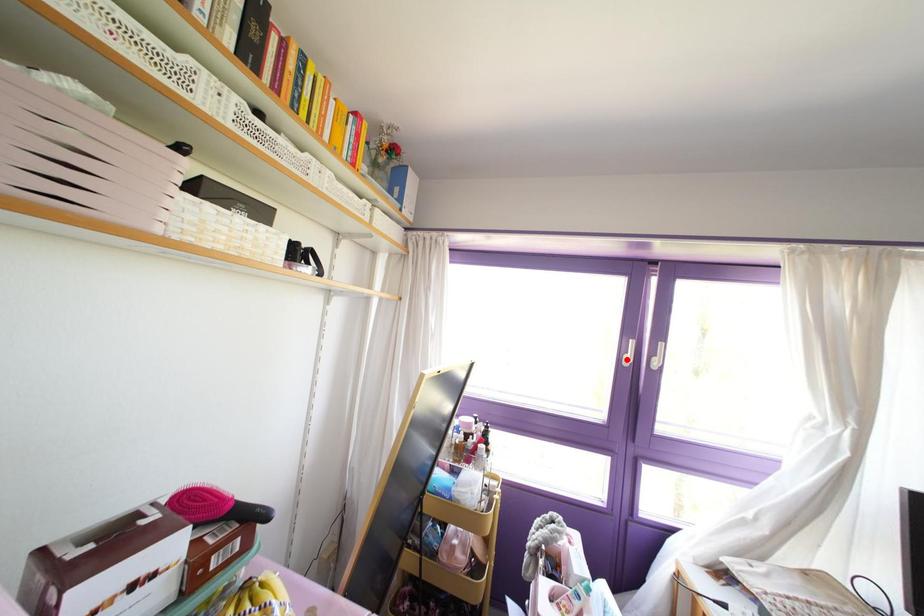
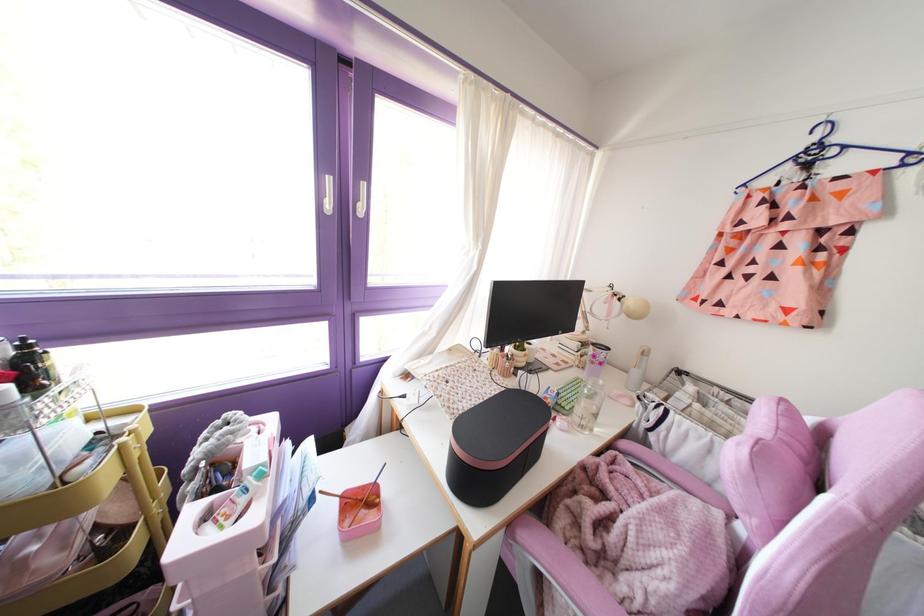
Locate, in the second image, the point that corresponds to the highlighted location in the first image.

(329, 205)